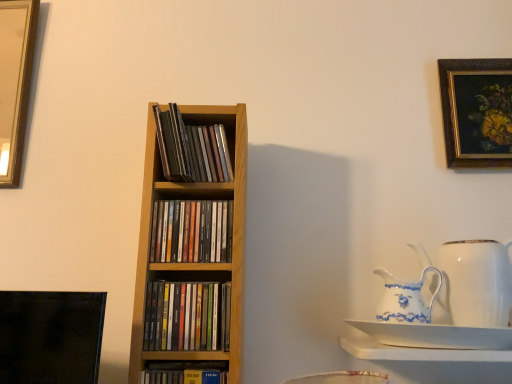
What is the approximate width of multicolored paper books at center, positioned as the second book in bottom-to-top order?

It is 2.46 inches.

The image size is (512, 384). Identify the location of matte black book at lower center, marked as the fourth book in a top-to-bottom arrangement. [x=183, y=372].

In order to face matte black book at lower center, the first book in the bottom-to-top sequence, should I rotate leftwards or rightwards?

Turn left approximately 9.888 degrees to face it.

Image resolution: width=512 pixels, height=384 pixels. Identify the location of wooden cd case at center, the 2th book from the top. (192, 231).

What do you see at coordinates (477, 112) in the screenshot? Image resolution: width=512 pixels, height=384 pixels. I see `gold-framed painting at upper right` at bounding box center [477, 112].

What is the approximate width of gold-framed painting at upper right?

1.13 inches.

I want to click on white glossy shelf at lower right, so click(x=417, y=352).

You are a GUI agent. You are given a task and a screenshot of the screen. Output one action in this format:
    pyautogui.click(x=<x>, y=<y>)
    Task: Click on the multicolored paper books at center, positioned as the second book in bottom-to-top order
    
    Given the screenshot: What is the action you would take?
    pyautogui.click(x=187, y=316)

Who is shorter, multicolored paper books at center, which is the 3th book in top-to-bottom order, or wooden cd case at center, the first book from the top?

multicolored paper books at center, which is the 3th book in top-to-bottom order, is shorter.

How many degrees apart are the facing directions of multicolored paper books at center, positioned as the second book in bottom-to-top order, and wooden cd case at center, the fourth book ordered from the bottom?

Result: The angle between the facing direction of multicolored paper books at center, positioned as the second book in bottom-to-top order, and the facing direction of wooden cd case at center, the fourth book ordered from the bottom, is 0.000279 degrees.

Considering the relative positions of multicolored paper books at center, positioned as the second book in bottom-to-top order, and wooden cd case at center, the fourth book ordered from the bottom, in the image provided, is multicolored paper books at center, positioned as the second book in bottom-to-top order, to the left or to the right of wooden cd case at center, the fourth book ordered from the bottom,?

multicolored paper books at center, positioned as the second book in bottom-to-top order, is to the left of wooden cd case at center, the fourth book ordered from the bottom.

From the image's perspective, does multicolored paper books at center, which is the 3th book in top-to-bottom order, appear lower than wooden cd case at center, the first book from the top?

Yes, from the image's perspective, multicolored paper books at center, which is the 3th book in top-to-bottom order, is beneath wooden cd case at center, the first book from the top.

Considering the relative sizes of wooden cd case at center, the first book from the top, and wooden cd case at center, the third book in the bottom-to-top sequence, in the image provided, is wooden cd case at center, the first book from the top, taller than wooden cd case at center, the third book in the bottom-to-top sequence,?

Correct, wooden cd case at center, the first book from the top, is much taller as wooden cd case at center, the third book in the bottom-to-top sequence.

Based on the photo, considering the sizes of objects wooden cd case at center, the fourth book ordered from the bottom, and wooden cd case at center, the third book in the bottom-to-top sequence, in the image provided, who is thinner, wooden cd case at center, the fourth book ordered from the bottom, or wooden cd case at center, the third book in the bottom-to-top sequence,?

Thinner between the two is wooden cd case at center, the third book in the bottom-to-top sequence.

Locate an element on the screen. book to the right of wooden cd case at center, the third book in the bottom-to-top sequence is located at coordinates (191, 149).

From a real-world perspective, is wooden cd case at center, the first book from the top, under wooden cd case at center, the 2th book from the top?

Actually, wooden cd case at center, the first book from the top, is physically above wooden cd case at center, the 2th book from the top, in the real world.

How many degrees apart are the facing directions of gold-framed painting at upper right and multicolored paper books at center, positioned as the second book in bottom-to-top order?

1.46 degrees separate the facing orientations of gold-framed painting at upper right and multicolored paper books at center, positioned as the second book in bottom-to-top order.

Between gold-framed painting at upper right and multicolored paper books at center, positioned as the second book in bottom-to-top order, which one has less height?

multicolored paper books at center, positioned as the second book in bottom-to-top order.

Is point (484, 128) closer to camera compared to point (201, 346)?

No, (484, 128) is behind (201, 346).

Are gold-framed painting at upper right and multicolored paper books at center, which is the 3th book in top-to-bottom order, beside each other?

gold-framed painting at upper right and multicolored paper books at center, which is the 3th book in top-to-bottom order, are not in contact.

Are white porcelain saucer at lower right and gold-framed painting at upper right beside each other?

No, white porcelain saucer at lower right is not in contact with gold-framed painting at upper right.

Could you tell me if white porcelain saucer at lower right is facing gold-framed painting at upper right?

No, white porcelain saucer at lower right is not aimed at gold-framed painting at upper right.

Locate an element on the screen. This screenshot has height=384, width=512. saucer located underneath the gold-framed painting at upper right (from a real-world perspective) is located at coordinates (435, 335).

Considering the relative sizes of white porcelain saucer at lower right and gold-framed painting at upper right in the image provided, is white porcelain saucer at lower right smaller than gold-framed painting at upper right?

No, white porcelain saucer at lower right is not smaller than gold-framed painting at upper right.

From the picture: Who is taller, wooden cd case at center, the 2th book from the top, or white porcelain saucer at lower right?

Standing taller between the two is wooden cd case at center, the 2th book from the top.

Visually, is wooden cd case at center, the 2th book from the top, positioned to the left or to the right of white porcelain saucer at lower right?

wooden cd case at center, the 2th book from the top, is positioned on white porcelain saucer at lower right's left side.

Is wooden cd case at center, the 2th book from the top, inside or outside of white porcelain saucer at lower right?

wooden cd case at center, the 2th book from the top, lies outside white porcelain saucer at lower right.

Who is bigger, gold-framed painting at upper right or wooden cd case at center, the third book in the bottom-to-top sequence?

gold-framed painting at upper right.

Between gold-framed painting at upper right and wooden cd case at center, the third book in the bottom-to-top sequence, which one has more height?

Standing taller between the two is gold-framed painting at upper right.

From a real-world perspective, who is located lower, gold-framed painting at upper right or wooden cd case at center, the 2th book from the top?

wooden cd case at center, the 2th book from the top.

Considering the sizes of gold-framed painting at upper right and wooden cd case at center, the 2th book from the top, in the image, is gold-framed painting at upper right wider or thinner than wooden cd case at center, the 2th book from the top,?

In the image, gold-framed painting at upper right appears to be more narrow than wooden cd case at center, the 2th book from the top.

Based on the photo, considering the sizes of objects white porcelain jug at right, the second jug viewed from the left, and white porcelain jug at right, the 1th jug when ordered from left to right, in the image provided, who is shorter, white porcelain jug at right, the second jug viewed from the left, or white porcelain jug at right, the 1th jug when ordered from left to right,?

white porcelain jug at right, the 1th jug when ordered from left to right, is shorter.

Does white porcelain jug at right, the second jug viewed from the left, appear on the right side of white porcelain jug at right, the 1th jug when ordered from left to right?

Indeed, white porcelain jug at right, the second jug viewed from the left, is positioned on the right side of white porcelain jug at right, the 1th jug when ordered from left to right.

From a real-world perspective, is white porcelain jug at right, which is the 1th jug from right to left, located beneath white porcelain jug at right, the 1th jug when ordered from left to right?

Incorrect, from a real-world perspective, white porcelain jug at right, which is the 1th jug from right to left, is higher than white porcelain jug at right, the 1th jug when ordered from left to right.

Which book is the 2nd one when counting from the back of the multicolored paper books at center, which is the 3th book in top-to-bottom order? Please provide its 2D coordinates.

[(191, 149)]

The width and height of the screenshot is (512, 384). I want to click on book located above the wooden cd case at center, the third book in the bottom-to-top sequence (from a real-world perspective), so click(191, 149).

Consider the image. Considering their positions, is white porcelain jug at right, the 1th jug when ordered from left to right, positioned closer to multicolored paper books at center, which is the 3th book in top-to-bottom order, than white porcelain jug at right, the second jug viewed from the left?

white porcelain jug at right, the 1th jug when ordered from left to right, is positioned closer to the anchor multicolored paper books at center, which is the 3th book in top-to-bottom order.

Looking at the image, which one is located further to gold-framed painting at upper right, white porcelain jug at right, which is counted as the second jug, starting from the right, or wooden cd case at center, the fourth book ordered from the bottom?

wooden cd case at center, the fourth book ordered from the bottom, lies further to gold-framed painting at upper right than the other object.

Based on their spatial positions, is wooden cd case at center, the third book in the bottom-to-top sequence, or multicolored paper books at center, which is the 3th book in top-to-bottom order, further from gold-framed painting at upper right?

multicolored paper books at center, which is the 3th book in top-to-bottom order, lies further to gold-framed painting at upper right than the other object.

When comparing their distances from multicolored paper books at center, positioned as the second book in bottom-to-top order, does gold-framed painting at upper right or white porcelain jug at right, which is the 1th jug from right to left, seem further?

Among the two, gold-framed painting at upper right is located further to multicolored paper books at center, positioned as the second book in bottom-to-top order.

Based on their spatial positions, is white porcelain jug at right, which is the 1th jug from right to left, or wooden cd case at center, the first book from the top, further from white porcelain jug at right, which is counted as the second jug, starting from the right?

wooden cd case at center, the first book from the top, is further to white porcelain jug at right, which is counted as the second jug, starting from the right.

From the image, which object appears to be nearer to wooden cd case at center, the first book from the top, white glossy shelf at lower right or matte black book at lower center, marked as the fourth book in a top-to-bottom arrangement?

Based on the image, matte black book at lower center, marked as the fourth book in a top-to-bottom arrangement, appears to be nearer to wooden cd case at center, the first book from the top.

Based on their spatial positions, is multicolored paper books at center, which is the 3th book in top-to-bottom order, or white porcelain jug at right, the second jug viewed from the left, further from white porcelain saucer at lower right?

Among the two, multicolored paper books at center, which is the 3th book in top-to-bottom order, is located further to white porcelain saucer at lower right.

Considering their positions, is multicolored paper books at center, which is the 3th book in top-to-bottom order, positioned closer to gold-framed painting at upper right than white porcelain saucer at lower right?

white porcelain saucer at lower right lies closer to gold-framed painting at upper right than the other object.

This screenshot has height=384, width=512. Identify the location of shelf located between wooden cd case at center, the third book in the bottom-to-top sequence, and gold-framed painting at upper right in the left-right direction. (417, 352).

Identify the location of jug between multicolored paper books at center, which is the 3th book in top-to-bottom order, and white porcelain saucer at lower right from left to right. The width and height of the screenshot is (512, 384). (405, 299).

In order to click on jug situated between wooden cd case at center, the fourth book ordered from the bottom, and white porcelain saucer at lower right from left to right in this screenshot , I will do `click(405, 299)`.

I want to click on jug between matte black book at lower center, the first book in the bottom-to-top sequence, and white glossy shelf at lower right, so click(405, 299).